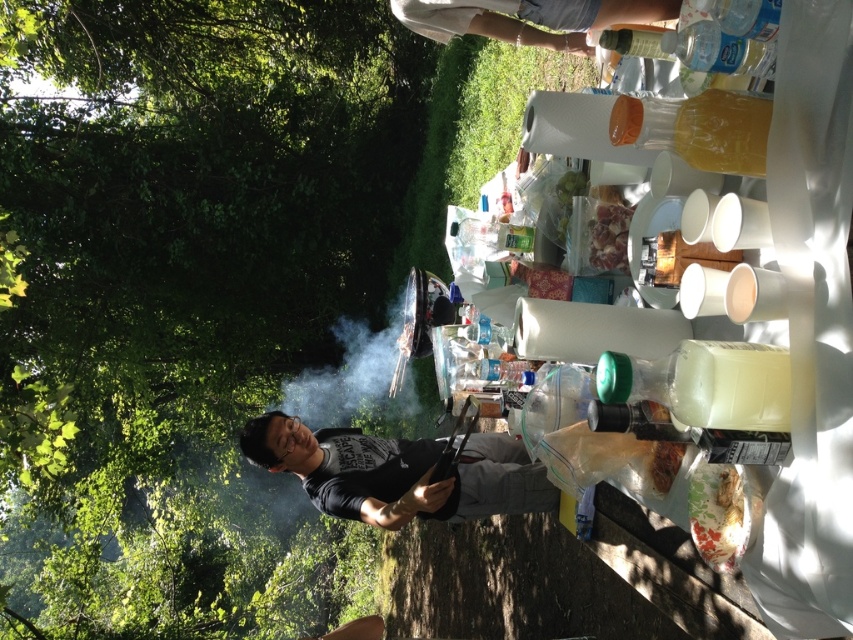
Can you confirm if black matte shirt at center is taller than clear plastic bottle at upper center?

Correct, black matte shirt at center is much taller as clear plastic bottle at upper center.

Does black matte shirt at center appear under clear plastic bottle at upper center?

Yes.

You are a GUI agent. You are given a task and a screenshot of the screen. Output one action in this format:
    pyautogui.click(x=<x>, y=<y>)
    Task: Click on the black matte shirt at center
    This screenshot has height=640, width=853.
    Given the screenshot: What is the action you would take?
    pyautogui.click(x=398, y=472)

Can you confirm if green leafy tree at upper left is positioned above clear plastic bottle at upper center?

Result: Actually, green leafy tree at upper left is below clear plastic bottle at upper center.

At what (x,y) coordinates should I click in order to perform the action: click on green leafy tree at upper left. Please return your answer as a coordinate pair (x, y). The image size is (853, 640). Looking at the image, I should click on (183, 292).

Can you confirm if green leafy tree at upper left is positioned below black matte shirt at center?

No.

You are a GUI agent. You are given a task and a screenshot of the screen. Output one action in this format:
    pyautogui.click(x=<x>, y=<y>)
    Task: Click on the green leafy tree at upper left
    The height and width of the screenshot is (640, 853).
    Given the screenshot: What is the action you would take?
    pyautogui.click(x=183, y=292)

The image size is (853, 640). What are the coordinates of `green leafy tree at upper left` in the screenshot? It's located at (183, 292).